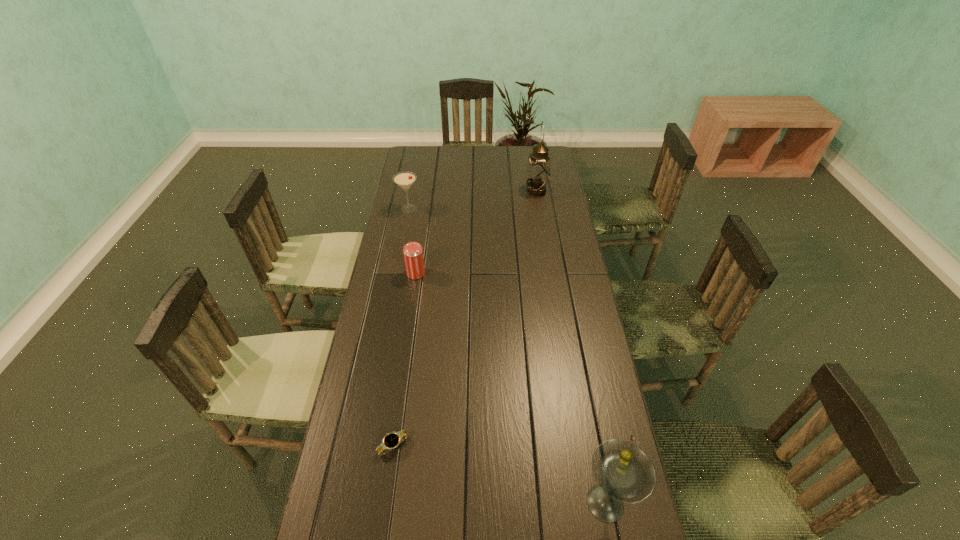
In order to click on vacant space in between the right martini and the beer can in this screenshot , I will do `click(511, 388)`.

At what (x,y) coordinates should I click in order to perform the action: click on free space between the oil lamp and the fourth tallest object. Please return your answer as a coordinate pair (x, y). The height and width of the screenshot is (540, 960). Looking at the image, I should click on (476, 232).

Where is `free spot between the second shortest object and the shortest object`? This screenshot has width=960, height=540. free spot between the second shortest object and the shortest object is located at coordinates (405, 360).

Point out which object is positioned as the nearest to the watch. Please provide its 2D coordinates. Your answer should be formatted as a tuple, i.e. [(x, y)], where the tuple contains the x and y coordinates of a point satisfying the conditions above.

[(624, 473)]

Locate an element on the screen. Image resolution: width=960 pixels, height=540 pixels. the fourth closest object to the fourth nearest object is located at coordinates (624, 473).

What are the coordinates of `free space in the image that satisfies the following two spatial constraints: 1. on the back side of the tallest object; 2. on the right side of the third farthest object` in the screenshot? It's located at (428, 191).

This screenshot has width=960, height=540. Find the location of `vacant position in the image that satisfies the following two spatial constraints: 1. on the front side of the shorter martini; 2. on the left side of the watch`. vacant position in the image that satisfies the following two spatial constraints: 1. on the front side of the shorter martini; 2. on the left side of the watch is located at coordinates (364, 446).

At what (x,y) coordinates should I click in order to perform the action: click on blank space that satisfies the following two spatial constraints: 1. on the front side of the shorter martini; 2. on the left side of the second shortest object. Please return your answer as a coordinate pair (x, y). Looking at the image, I should click on (396, 273).

This screenshot has width=960, height=540. What are the coordinates of `free space in the image that satisfies the following two spatial constraints: 1. on the front side of the oil lamp; 2. on the left side of the nearest object` in the screenshot? It's located at (587, 503).